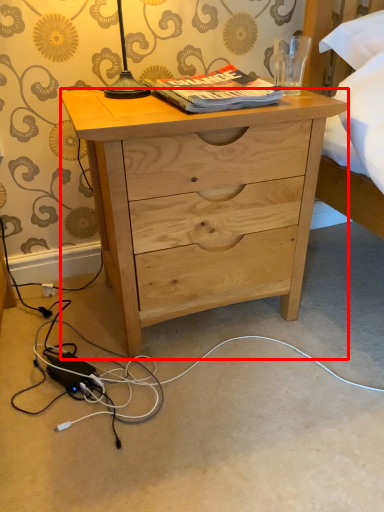
Question: From the image, what is the correct spatial relationship of desk (annotated by the red box) in relation to book?

Choices:
 (A) right
 (B) left

Answer: (B)